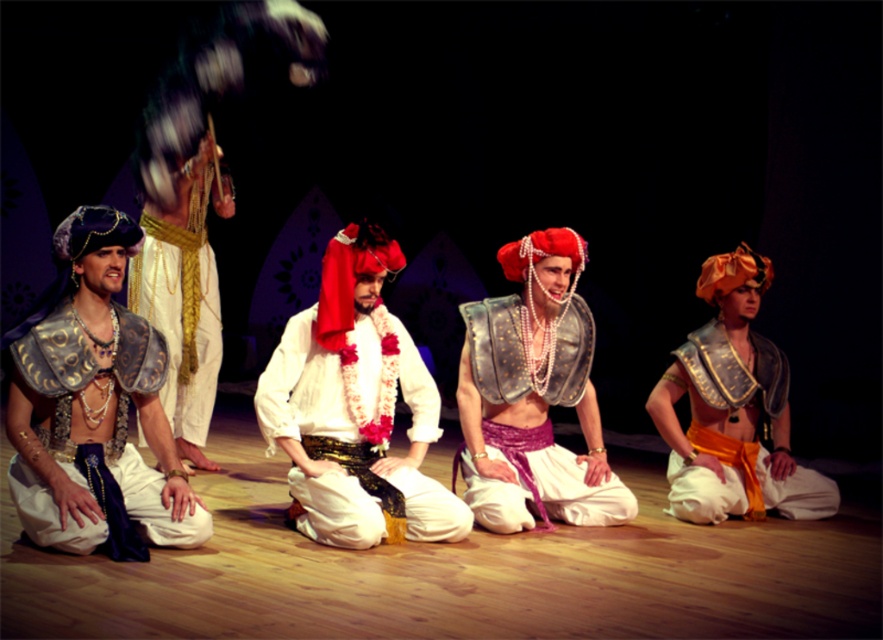
You are a stagehand who needs to adjust the lighting for the white satin shirt at center and the matte gold armor at center. Since they are 1.65 meters apart, will you need to use two separate spotlights to ensure both are fully illuminated?

The white satin shirt at center and matte gold armor at center are 1.65 meters apart, so yes, you will need two separate spotlights to fully illuminate both areas as the distance is significant enough to require individual focus.

You are a costume designer reviewing the stage setup. You notice the white satin shirt at center and the metallic blue fabric at left. Which garment is layered on top?

The white satin shirt at center is positioned over the metallic blue fabric at left, so the white satin shirt at center is layered on top.